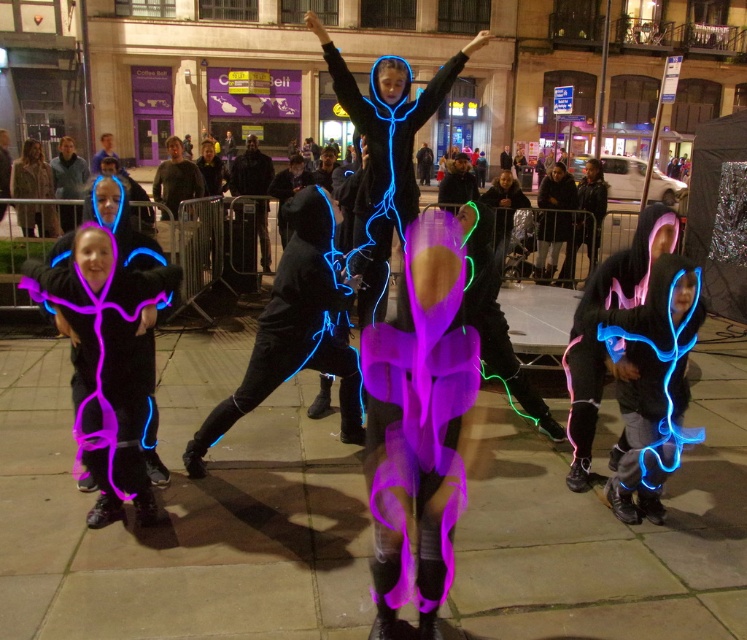
You are a photographer at the event and want to capture a photo where the neon blue fabric at center and neon purple fabric at center are clearly visible. Since the camera can only focus on one height, which fabric should you set the focus to ensure both are in focus?

The neon blue fabric at center is taller than the neon purple fabric at center. To ensure both are in focus, set the focus to the height of the neon blue fabric at center since it is taller and will cover the lower position of the neon purple fabric at center.

You are a photographer trying to capture the central performers. You notice two fabrics in the center area, the neon blue fabric at center and the neon purple fabric at center. Which fabric do you need to focus on if you want to capture the wider one?

The neon blue fabric at center might be wider than the neon purple fabric at center, so focusing on the neon blue fabric at center would likely capture the wider one.